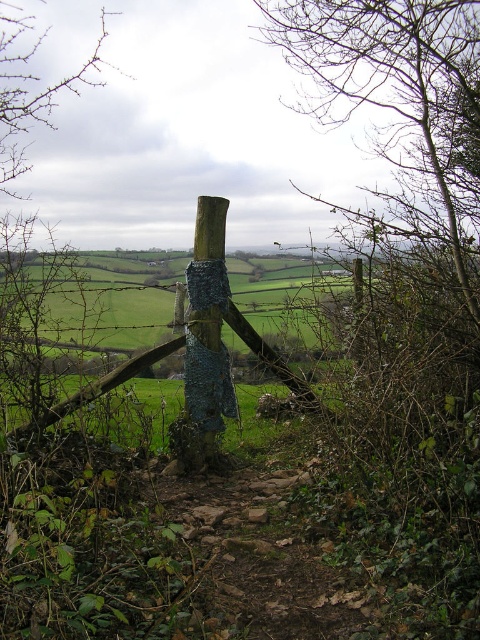
Question: Is blue knitted fabric at center to the right of bare branches at upper left from the viewer's perspective?

Choices:
 (A) yes
 (B) no

Answer: (A)

Question: From the image, what is the correct spatial relationship of blue knitted fabric at center in relation to bare branches at upper left?

Choices:
 (A) below
 (B) above

Answer: (A)

Question: Is blue knitted fabric at center further to the viewer compared to bare branches at upper left?

Choices:
 (A) yes
 (B) no

Answer: (A)